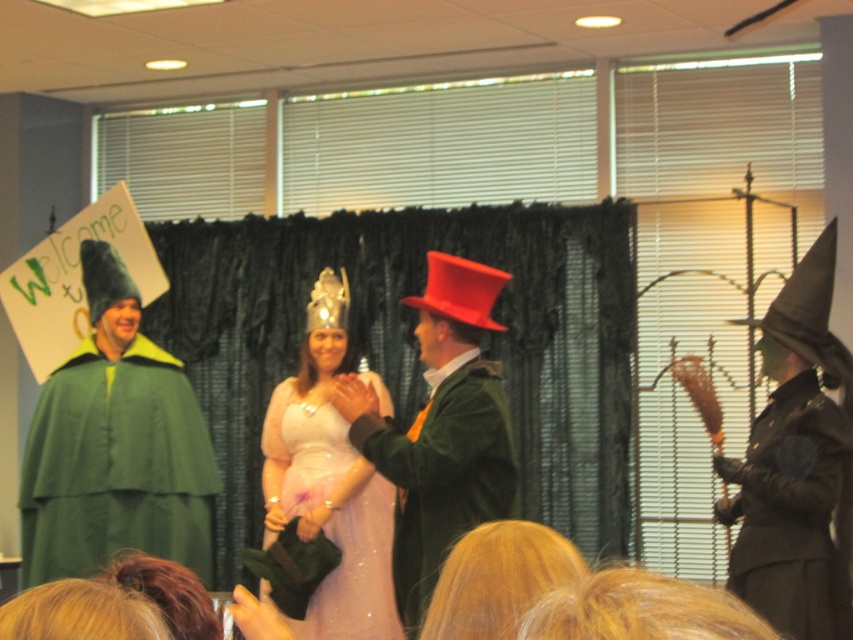
In the scene shown: You are a photographer at the event and need to adjust the camera focus. The pale pink satin dress at center and the shiny red top hat at center are part of the main subject. How far apart are these two items?

The pale pink satin dress at center and the shiny red top hat at center are 3.81 feet apart.

You are a photographer at the event and want to capture a photo of both the velvet green coat at center and the pale pink satin dress at center. Which one should you focus on first if you want to include both in the frame without moving the camera?

The velvet green coat at center is positioned on the right side of the pale pink satin dress at center, so you should focus on the pale pink satin dress at center first to ensure both are in the frame without moving the camera.